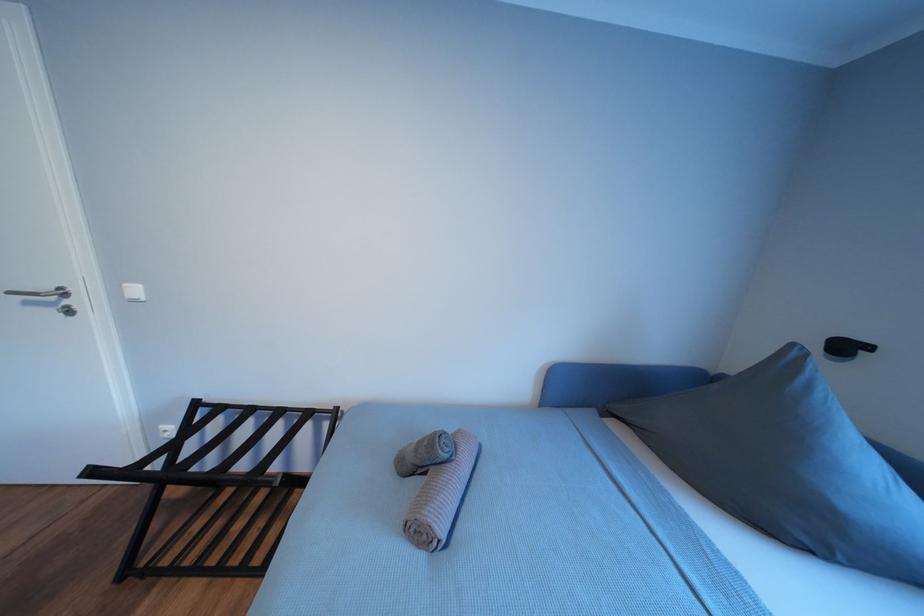
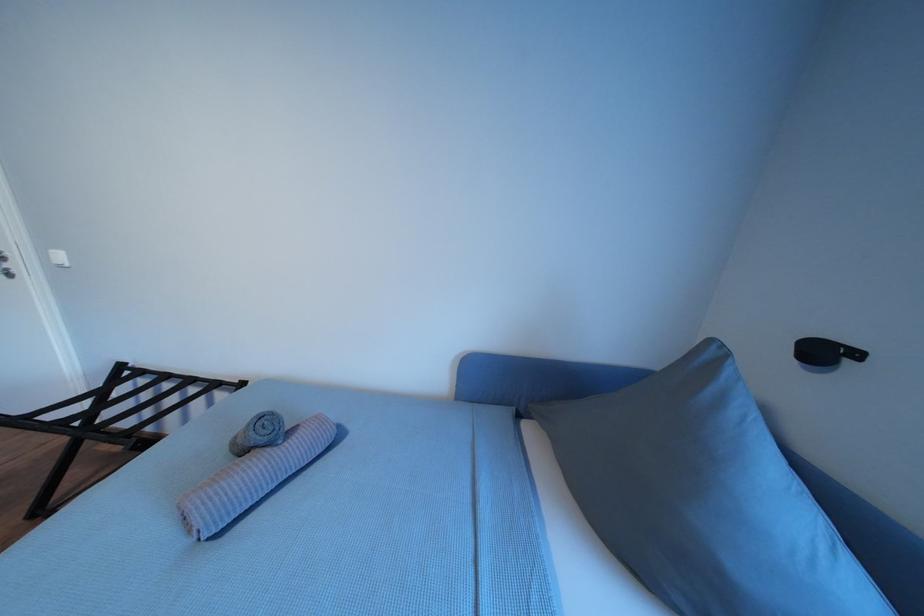
Question: Which direction would the cameraman need to move to produce the second image? Reply with the corresponding letter.

Choices:
 (A) Left
 (B) Right
 (C) Forward
 (D) Backward

Answer: (B)